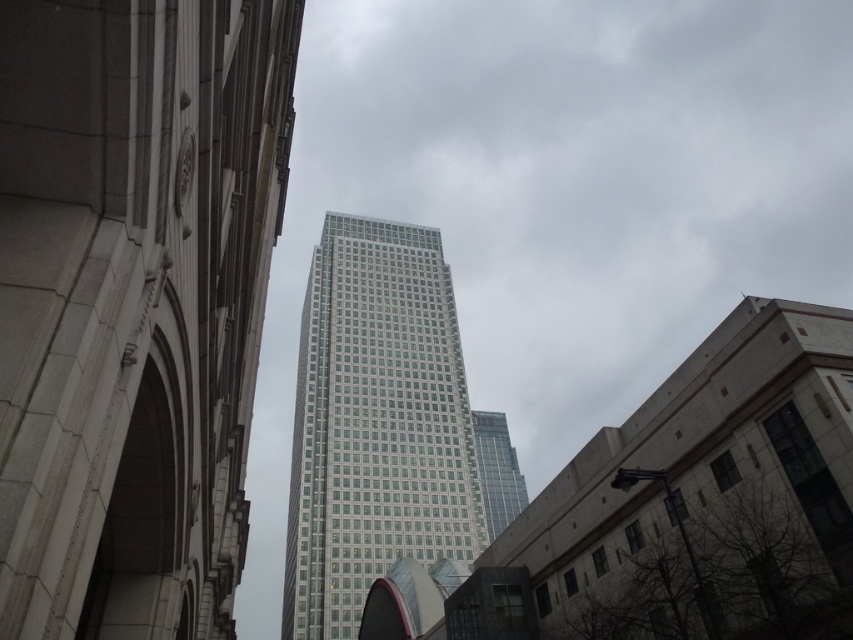
Who is more distant from viewer, (459, 490) or (526, 499)?

The point (526, 499) is behind.

Is white glass tower at center below clear glass skyscraper at center?

No.

Between point (440, 428) and point (500, 451), which one is positioned in front?

Positioned in front is point (440, 428).

Where is `white glass tower at center`? The image size is (853, 640). white glass tower at center is located at coordinates (375, 422).